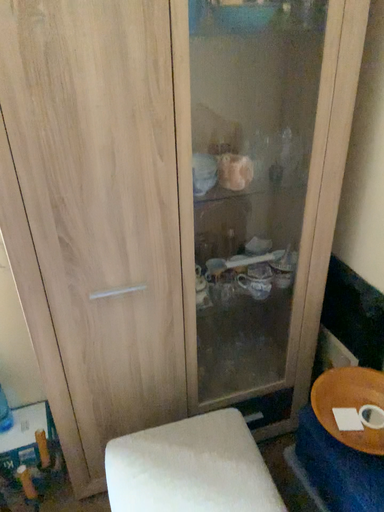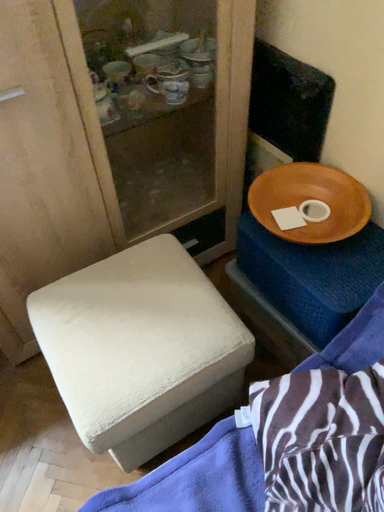
Question: How did the camera likely rotate when shooting the video?

Choices:
 (A) rotated left
 (B) rotated right

Answer: (B)